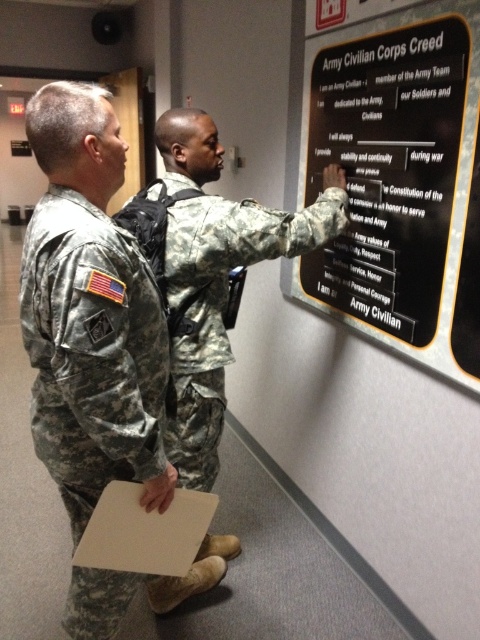
Is black matte sign at upper center taller than camouflage fabric uniform at left?

Yes, black matte sign at upper center is taller than camouflage fabric uniform at left.

Is point (312, 257) in front of point (57, 250)?

No, (312, 257) is behind (57, 250).

The height and width of the screenshot is (640, 480). Find the location of `black matte sign at upper center`. black matte sign at upper center is located at coordinates [389, 168].

Who is taller, camouflage fabric uniform at left or camouflage uniform at center?

With more height is camouflage uniform at center.

I want to click on camouflage fabric uniform at left, so click(x=92, y=352).

Can you confirm if black matte sign at upper center is taller than camouflage uniform at center?

Yes, black matte sign at upper center is taller than camouflage uniform at center.

Is point (462, 371) closer to viewer compared to point (217, 376)?

Yes.

Locate an element on the screen. This screenshot has width=480, height=640. black matte sign at upper center is located at coordinates (389, 168).